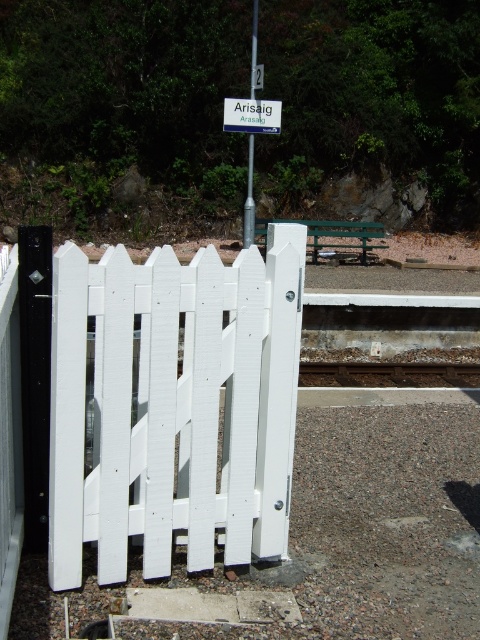
You are a maintenance worker on the Arisaig railway platform. You need to check the height of the white painted wood gate at center and the brown gravel train track at center to ensure safety regulations are met. According to the provided information, which object has a greater height?

The white painted wood gate at center has a greater height compared to the brown gravel train track at center, so the gate is taller.

You are standing at the Arisaig station platform and want to board the train. Where should you position yourself relative to the brown gravel train track at center to ensure you are on the correct platform?

The brown gravel train track at center is located at point [387,372], so you should position yourself near the center of the platform close to that coordinate to board the train correctly.

From the picture: You are a railway inspector checking the platform. You need to ensure that the brown gravel train track at center is wide enough to accommodate a new train model that requires a minimum track width of 3 meters. Given that the metallic pole at center is exactly 1 meter in width, can the track support the new train?

The brown gravel train track at center is wider than the metallic pole at center, which is 1 meter. Since the track is wider than 1 meter, it likely meets the minimum 3 meter requirement for the new train model.